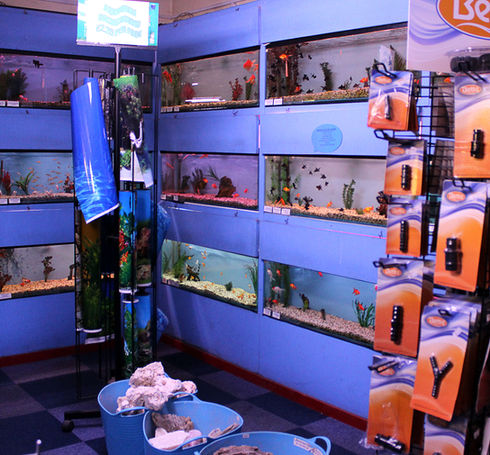
Image resolution: width=490 pixels, height=455 pixels. I want to click on rolled up tank background posters, so click(129, 248), click(147, 225), click(138, 142), click(89, 147), click(146, 319).